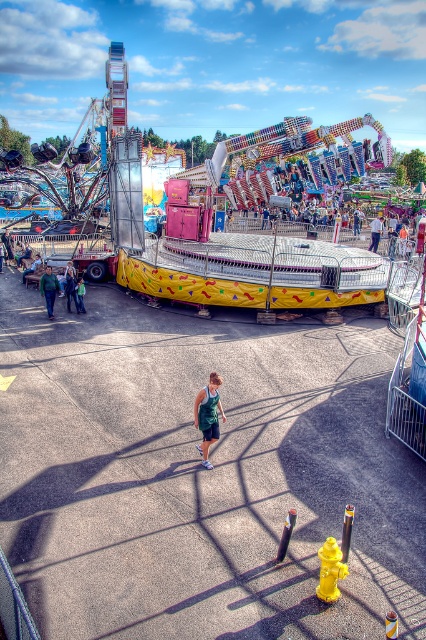
Question: Can you confirm if green fabric shorts at center is smaller than green fabric dress at center?

Choices:
 (A) yes
 (B) no

Answer: (A)

Question: Is the position of green fabric jacket at lower left more distant than that of green fabric dress at center?

Choices:
 (A) no
 (B) yes

Answer: (A)

Question: Is green fabric shorts at center to the right of green fabric jacket at lower left from the viewer's perspective?

Choices:
 (A) yes
 (B) no

Answer: (A)

Question: Which point is farther from the camera taking this photo?

Choices:
 (A) (216, 433)
 (B) (54, 284)

Answer: (B)

Question: Which object is the farthest from the green fabric dress at center?

Choices:
 (A) green fabric shorts at center
 (B) green fabric jacket at lower left

Answer: (A)

Question: Estimate the real-world distances between objects in this image. Which object is farther from the green fabric jacket at lower left?

Choices:
 (A) green fabric shorts at center
 (B) green fabric dress at center

Answer: (B)